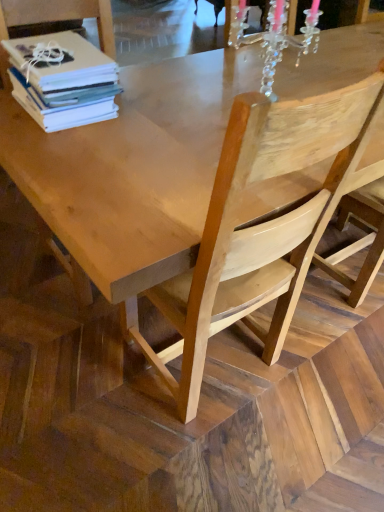
Image resolution: width=384 pixels, height=512 pixels. I want to click on free space in front of natural wood chair at center, which is counted as the 1th chair, starting from the left, so click(x=64, y=333).